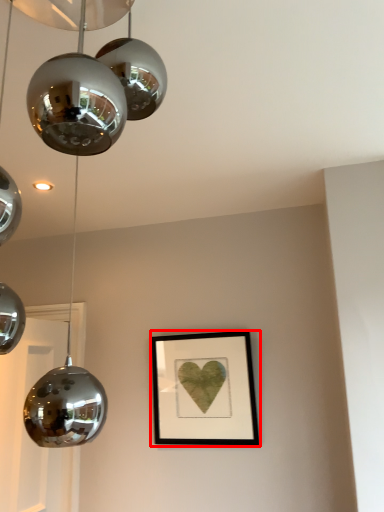
Question: From the image, what is the correct spatial relationship of picture frame (annotated by the red box) in relation to lamp?

Choices:
 (A) left
 (B) right

Answer: (B)